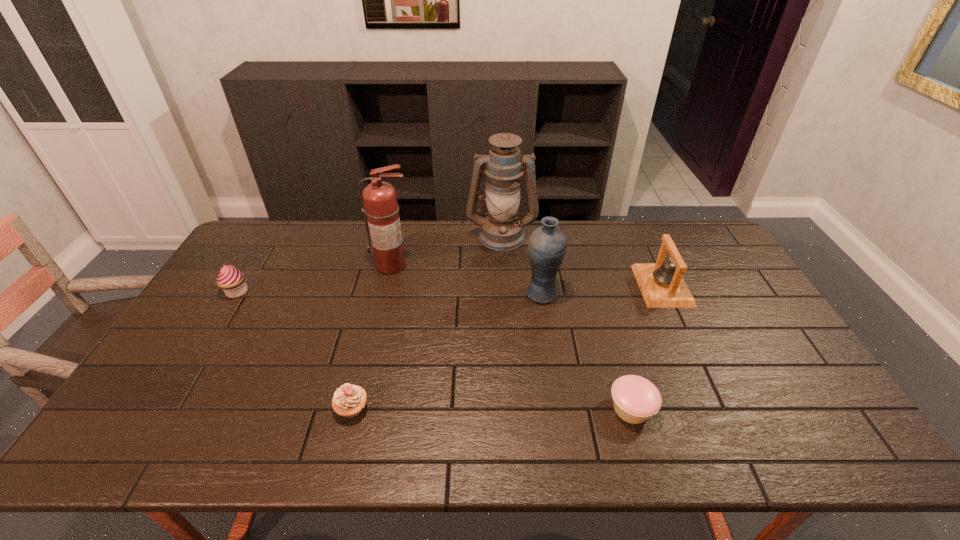
Where is `the rightmost cupcake`? The width and height of the screenshot is (960, 540). the rightmost cupcake is located at coordinates tap(635, 399).

Locate an element on the screen. free space located 0.160m on the right of the farthest object is located at coordinates (580, 235).

Where is `vacant space located on the front-facing side of the fire extinguisher`? This screenshot has width=960, height=540. vacant space located on the front-facing side of the fire extinguisher is located at coordinates (383, 303).

In order to click on free spot located 0.360m on the right of the vase in this screenshot , I will do `click(674, 294)`.

Where is `blank area located 0.140m on the front of the rightmost object`? Image resolution: width=960 pixels, height=540 pixels. blank area located 0.140m on the front of the rightmost object is located at coordinates (689, 343).

Identify the location of vacant space located on the right of the leftmost object. The image size is (960, 540). (326, 292).

Identify the location of free space located on the back of the second cupcake from right to left. The image size is (960, 540). (378, 302).

Locate an element on the screen. The height and width of the screenshot is (540, 960). blank space located on the back of the sixth object from left to right is located at coordinates click(601, 305).

At what (x,y) coordinates should I click in order to perform the action: click on oil lamp located in the far edge section of the desktop. Please return your answer as a coordinate pair (x, y). The width and height of the screenshot is (960, 540). Looking at the image, I should click on (501, 230).

In order to click on fire extinguisher at the far edge in this screenshot , I will do `click(381, 208)`.